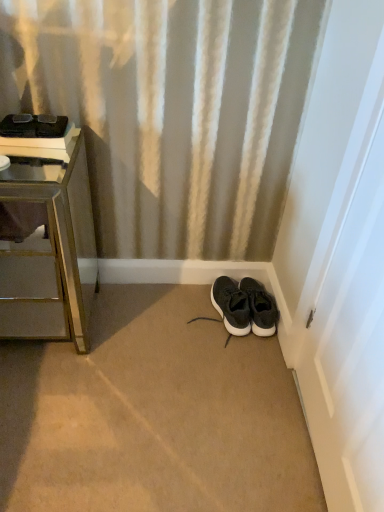
Locate an element on the screen. vacant space situated on the left part of black fabric sneakers at center, acting as the 2th footwear starting from the right is located at coordinates (186, 307).